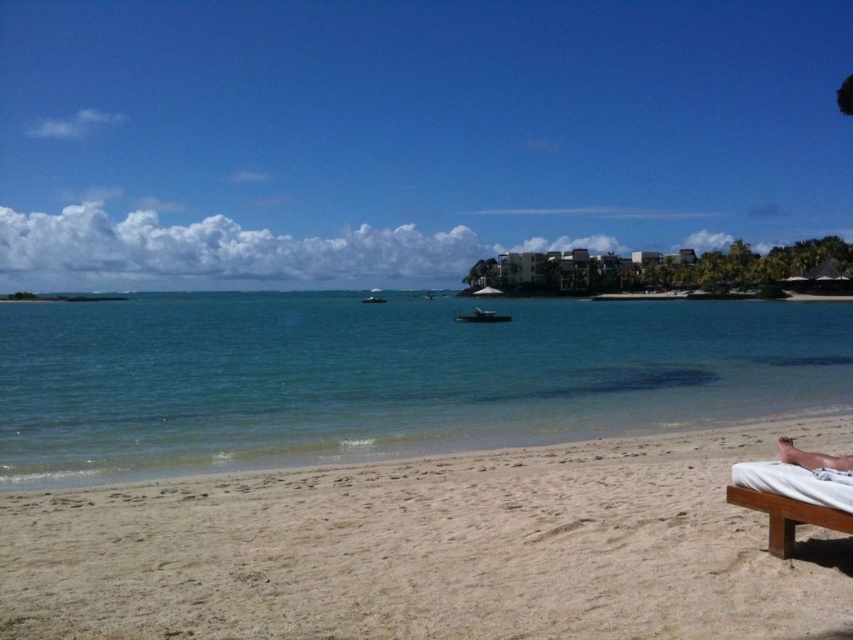
Question: Which object appears farthest from the camera in this image?

Choices:
 (A) light beige sand at lower right
 (B) white fabric beach chair at lower right
 (C) clear blue water at center

Answer: (C)

Question: Where is white fabric beach chair at lower right located in relation to tan skin person at lower right in the image?

Choices:
 (A) right
 (B) left

Answer: (B)

Question: Does white fabric beach chair at lower right appear under tan skin person at lower right?

Choices:
 (A) yes
 (B) no

Answer: (A)

Question: Where is white fabric beach chair at lower right located in relation to tan skin person at lower right in the image?

Choices:
 (A) left
 (B) right

Answer: (A)

Question: Estimate the real-world distances between objects in this image. Which object is closer to the tan skin person at lower right?

Choices:
 (A) white fabric beach chair at lower right
 (B) light beige sand at lower right

Answer: (A)

Question: Which point is farther to the camera?

Choices:
 (A) (482, 500)
 (B) (780, 500)
 (C) (415, 314)
 (D) (821, 452)

Answer: (C)